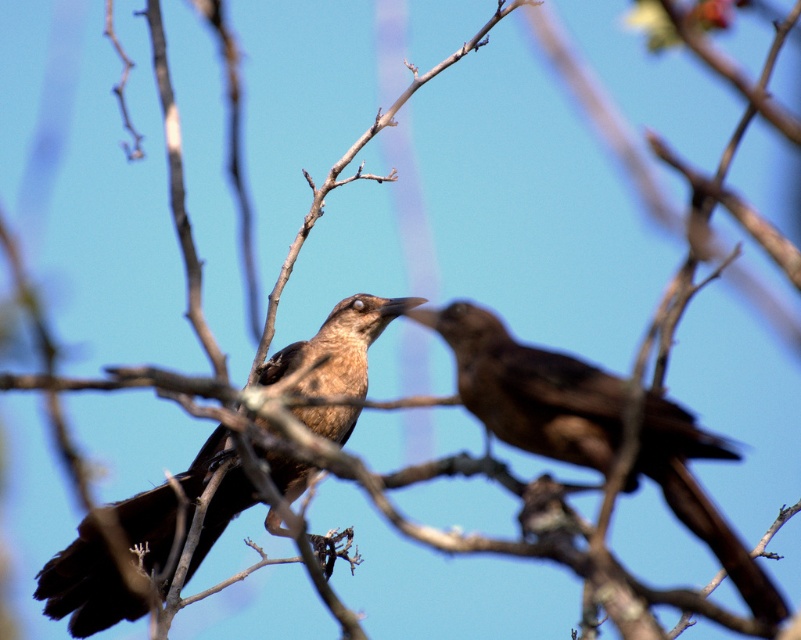
Where is `brown matte bird at right`? brown matte bird at right is located at coordinates point(530,388).